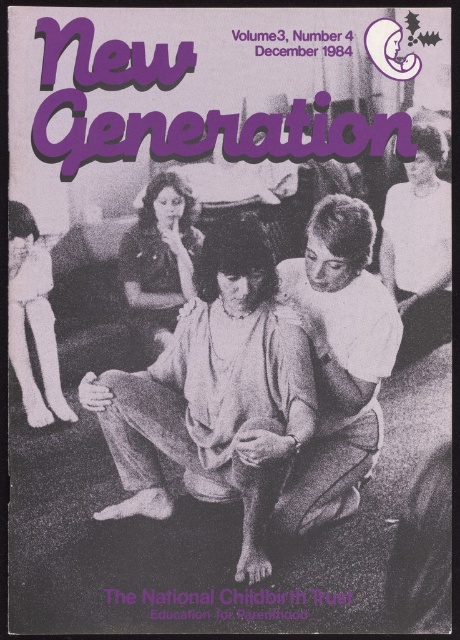
Is white smooth shirt at right wider than matte white doll at left?

In fact, white smooth shirt at right might be narrower than matte white doll at left.

Between white smooth shirt at right and matte white doll at left, which one appears on the left side from the viewer's perspective?

From the viewer's perspective, matte white doll at left appears more on the left side.

At what (x,y) coordinates should I click in order to perform the action: click on white smooth shirt at right. Please return your answer as a coordinate pair (x, y). Image resolution: width=460 pixels, height=640 pixels. Looking at the image, I should click on (419, 248).

Is white smooth shirt at right smaller than matte black shirt at center?

No, white smooth shirt at right is not smaller than matte black shirt at center.

Does white smooth shirt at right lie behind matte black shirt at center?

No, it is in front of matte black shirt at center.

Is point (413, 196) closer to viewer compared to point (157, 349)?

No, it is behind (157, 349).

What are the coordinates of `white smooth shirt at right` in the screenshot? It's located at (419, 248).

Which is more to the left, matte black shirt at center or matte white doll at left?

Positioned to the left is matte white doll at left.

Between matte black shirt at center and matte white doll at left, which one is positioned higher?

matte black shirt at center is higher up.

Between point (190, 244) and point (11, 216), which one is positioned in front?

Point (11, 216) is more forward.

This screenshot has height=640, width=460. What are the coordinates of `matte black shirt at center` in the screenshot? It's located at (160, 259).